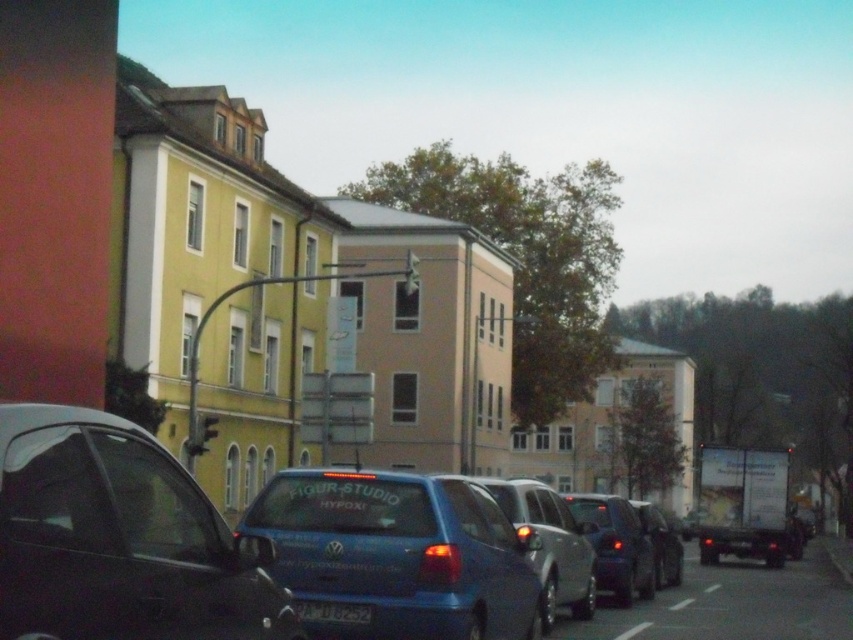
You are a driver approaching the intersection and see the black plastic license plate at lower center and the metallic gray traffic light at center. Which object is wider?

The black plastic license plate at lower center is wider than the metallic gray traffic light at center.

From the picture: You are a pedestrian standing on the sidewalk looking at the street. You see the black plastic license plate at lower center and the metallic gray traffic light at center. Which object is closer to you?

The black plastic license plate at lower center is closer to you because it is in front of the metallic gray traffic light at center.

You are a delivery driver who needs to park your truck, which is 2 meters long, in the space between the shiny black sedan at center and the white rubber line at center. According to the scene, can your truck fit in that space?

The shiny black sedan at center is smaller than the white rubber line at center, so the space between them is larger than the sedan. However, the exact dimensions are not provided, so it is uncertain whether the truck will fit. Please check the actual space before attempting to park.